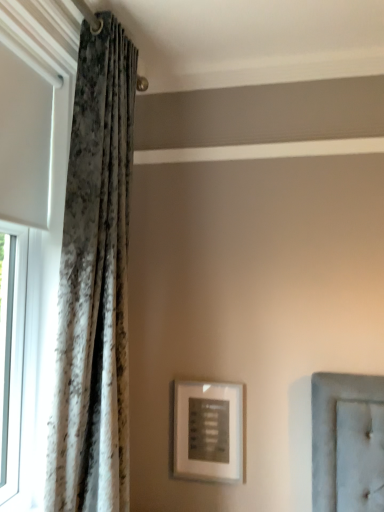
Question: Does matte silver picture frame at center turn towards white textured curtain at left?

Choices:
 (A) yes
 (B) no

Answer: (B)

Question: Does matte silver picture frame at center have a lesser height compared to white textured curtain at left?

Choices:
 (A) no
 (B) yes

Answer: (B)

Question: Is matte silver picture frame at center behind white textured curtain at left?

Choices:
 (A) yes
 (B) no

Answer: (A)

Question: Considering the relative sizes of matte silver picture frame at center and white textured curtain at left in the image provided, is matte silver picture frame at center wider than white textured curtain at left?

Choices:
 (A) yes
 (B) no

Answer: (B)

Question: Is matte silver picture frame at center smaller than white textured curtain at left?

Choices:
 (A) no
 (B) yes

Answer: (B)

Question: From the image's perspective, is white textured curtain at left located above or below velvet-like curtain at left?

Choices:
 (A) below
 (B) above

Answer: (B)

Question: Considering the positions of point (66, 16) and point (66, 345), is point (66, 16) closer or farther from the camera than point (66, 345)?

Choices:
 (A) farther
 (B) closer

Answer: (A)

Question: Is white textured curtain at left inside the boundaries of velvet-like curtain at left, or outside?

Choices:
 (A) inside
 (B) outside

Answer: (B)

Question: Would you say white textured curtain at left is to the left or to the right of velvet-like curtain at left in the picture?

Choices:
 (A) left
 (B) right

Answer: (A)

Question: Considering the positions of matte silver picture frame at center and velvet-like curtain at left in the image, is matte silver picture frame at center taller or shorter than velvet-like curtain at left?

Choices:
 (A) tall
 (B) short

Answer: (B)

Question: From the image's perspective, is matte silver picture frame at center above or below velvet-like curtain at left?

Choices:
 (A) above
 (B) below

Answer: (B)

Question: From a real-world perspective, is matte silver picture frame at center above or below velvet-like curtain at left?

Choices:
 (A) below
 (B) above

Answer: (A)

Question: Is matte silver picture frame at center situated inside velvet-like curtain at left or outside?

Choices:
 (A) outside
 (B) inside

Answer: (A)

Question: From their relative heights in the image, would you say velvet-like curtain at left is taller or shorter than matte silver picture frame at center?

Choices:
 (A) short
 (B) tall

Answer: (B)

Question: From a real-world perspective, is velvet-like curtain at left above or below matte silver picture frame at center?

Choices:
 (A) above
 (B) below

Answer: (A)